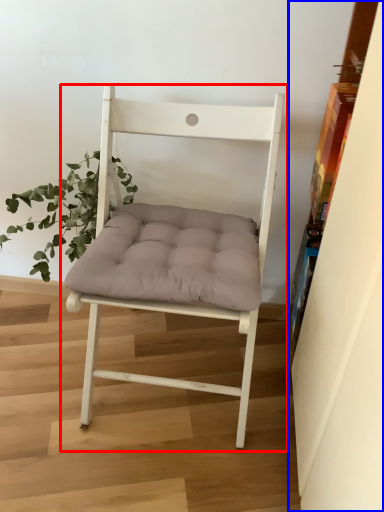
Question: Which point is further to the camera, chair (highlighted by a red box) or shelf (highlighted by a blue box)?

Choices:
 (A) chair
 (B) shelf

Answer: (A)